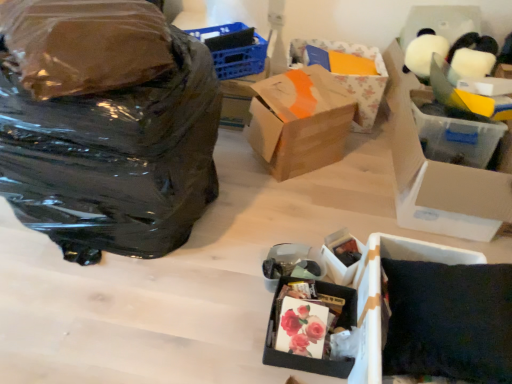
I want to click on free spot above matte black box at lower center, the 5th box when ordered from top to bottom (from a real-world perspective), so click(308, 321).